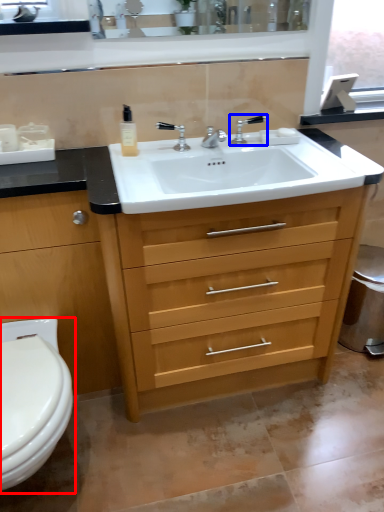
Question: Which of the following is the closest to the observer, toilet (highlighted by a red box) or tap (highlighted by a blue box)?

Choices:
 (A) toilet
 (B) tap

Answer: (A)